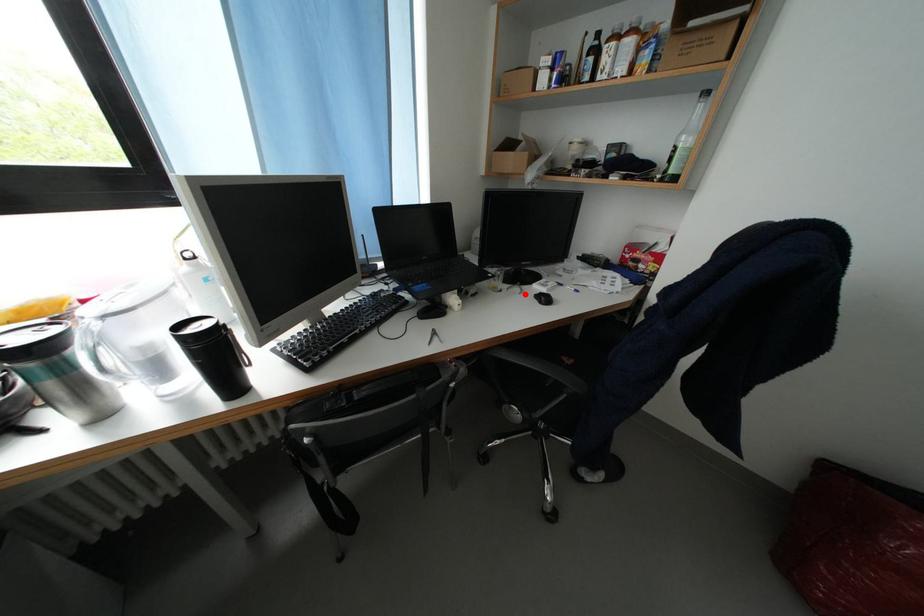
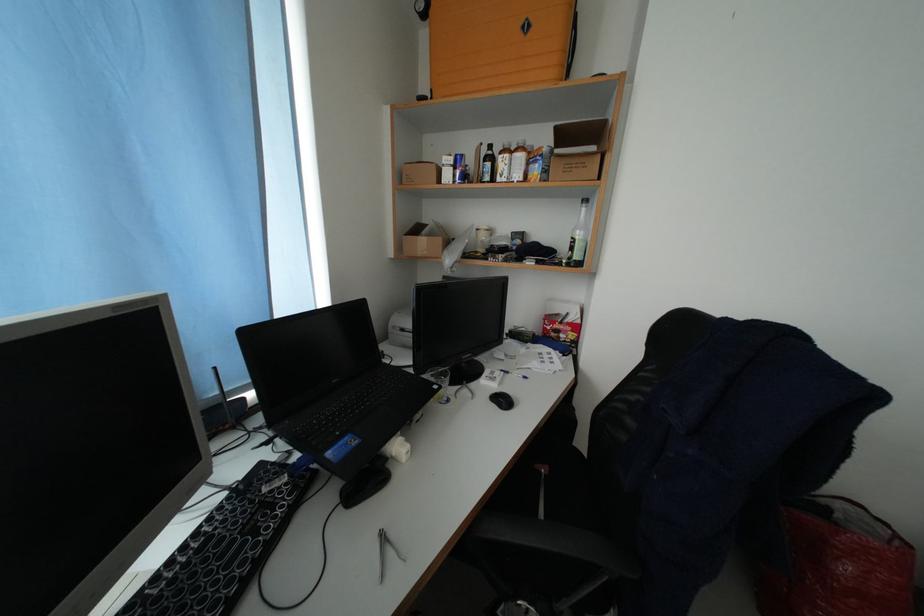
Find the pixel in the second image that matches the highlighted location in the first image.

(473, 397)